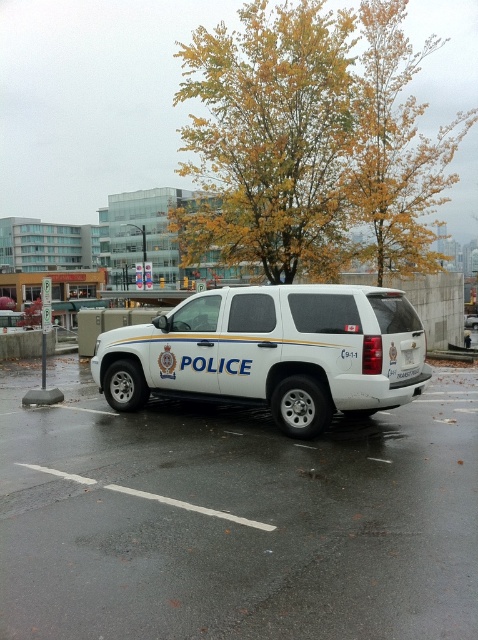
Question: Is white glossy police car at center further to camera compared to yellow-green leaves at upper center?

Choices:
 (A) yes
 (B) no

Answer: (B)

Question: Observing the image, what is the correct spatial positioning of yellow-green leaves at upper center in reference to white matte police suv at center?

Choices:
 (A) below
 (B) above

Answer: (B)

Question: Which point is farther from the camera taking this photo?

Choices:
 (A) (404, 369)
 (B) (323, 364)
 (C) (403, 118)
 (D) (216, 561)

Answer: (C)

Question: Is yellow-green leaves at upper center bigger than yellow leaves at upper center?

Choices:
 (A) yes
 (B) no

Answer: (A)

Question: Which of the following is the closest to the observer?

Choices:
 (A) yellow leaves at upper center
 (B) white plastic license plate at rear

Answer: (B)

Question: Which object is positioned farthest from the white glossy police car at center?

Choices:
 (A) yellow leaves at upper center
 (B) yellow-green leaves at upper center
 (C) white plastic license plate at rear
 (D) white matte police suv at center

Answer: (A)